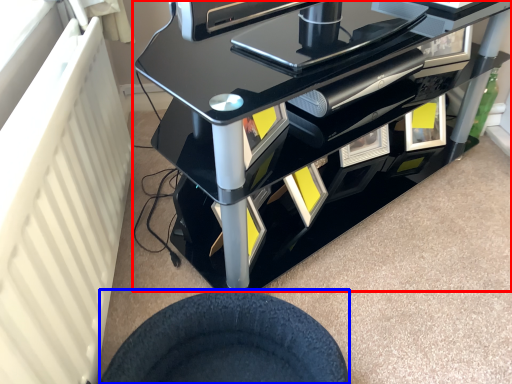
Question: Which object is closer to the camera taking this photo, furniture (highlighted by a red box) or wheel (highlighted by a blue box)?

Choices:
 (A) furniture
 (B) wheel

Answer: (B)